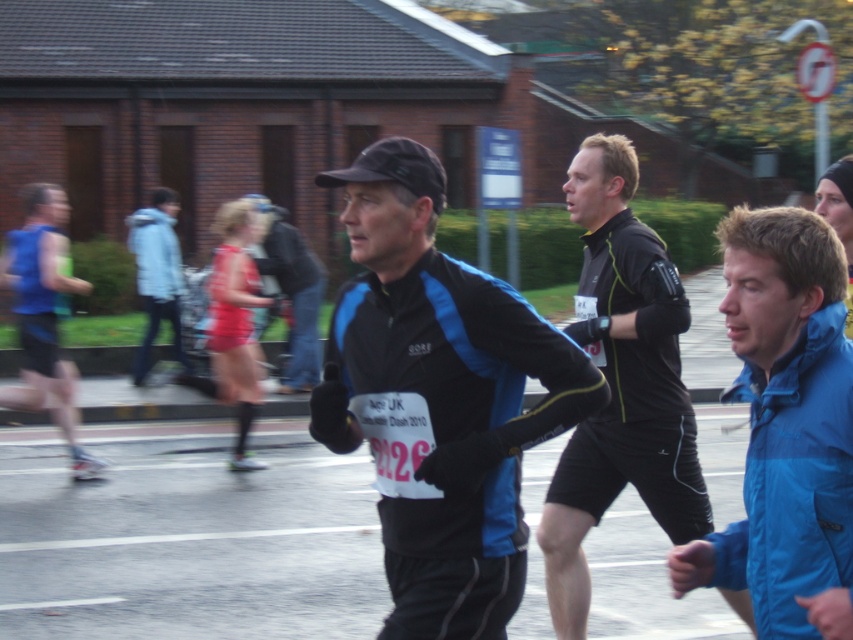
Measure the distance between blue running vest at left and red fabric skirt at center.

blue running vest at left is 4.75 feet away from red fabric skirt at center.

Is blue running vest at left behind red fabric skirt at center?

No, blue running vest at left is closer to the viewer.

Is point (35, 397) closer to camera compared to point (230, 253)?

Yes, it is.

Find the location of a particular element. The image size is (853, 640). blue running vest at left is located at coordinates (44, 316).

The height and width of the screenshot is (640, 853). I want to click on blue running vest at left, so click(44, 316).

This screenshot has width=853, height=640. I want to click on blue running vest at left, so click(44, 316).

From the picture: Which is above, blue fabric jacket at center or light blue fabric jacket at upper left?

light blue fabric jacket at upper left

Is the position of blue fabric jacket at center more distant than that of light blue fabric jacket at upper left?

No, it is not.

Between point (288, 336) and point (134, 230), which one is positioned in front?

Positioned in front is point (288, 336).

What are the coordinates of `blue fabric jacket at center` in the screenshot? It's located at [293, 292].